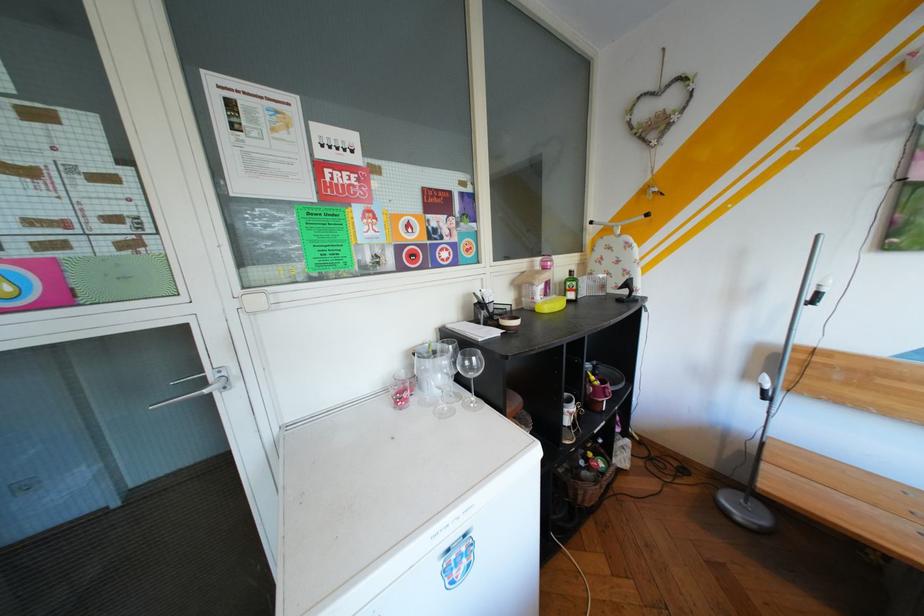
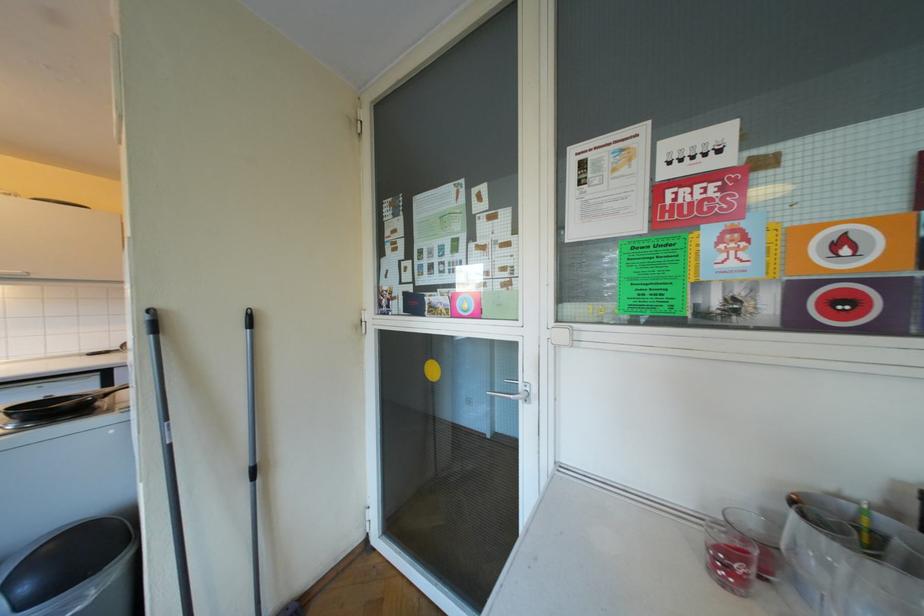
Question: How did the camera likely rotate?

Choices:
 (A) Left
 (B) Right
 (C) Up
 (D) Down

Answer: (A)